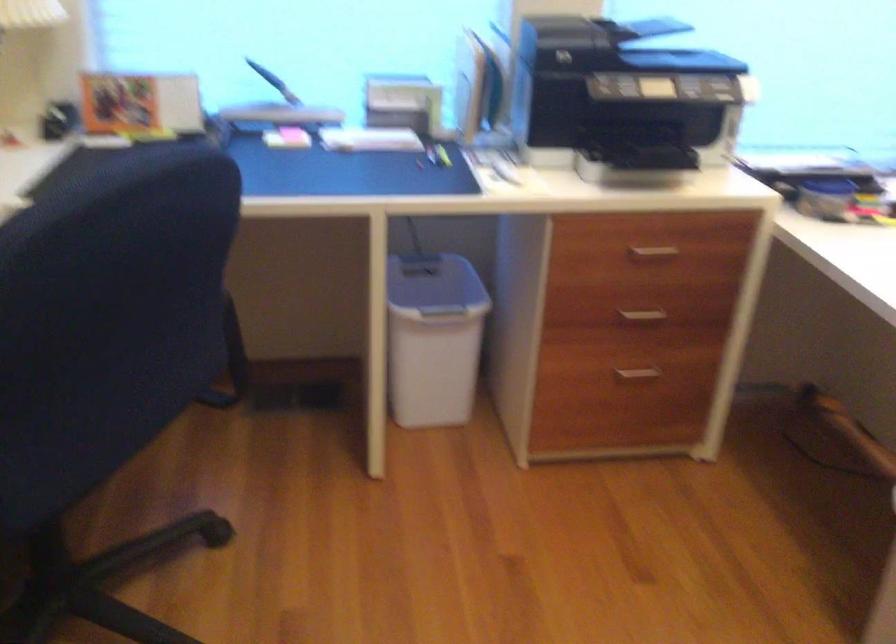
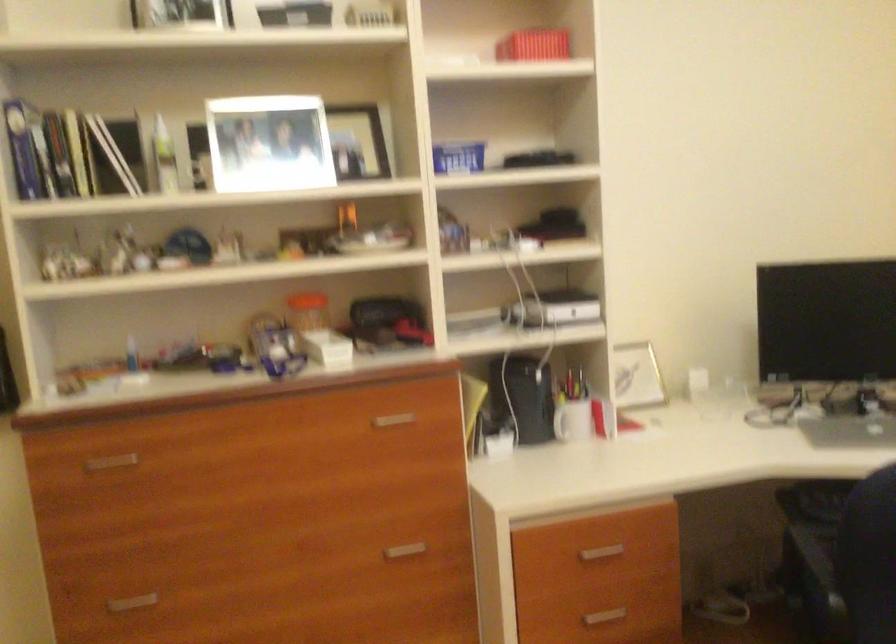
Question: How did the camera likely rotate?

Choices:
 (A) Left
 (B) Right
 (C) Up
 (D) Down

Answer: (A)